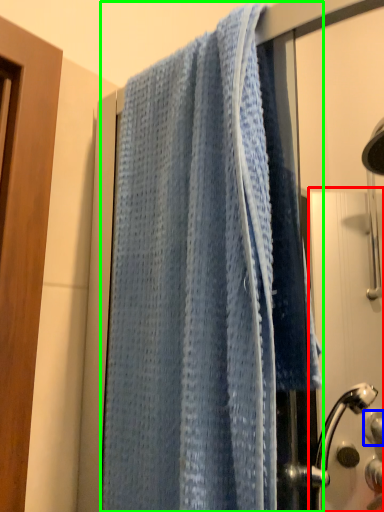
Question: Based on their relative distances, which object is nearer to screen door (highlighted by a red box)? Choose from knob (highlighted by a blue box) and towel (highlighted by a green box).

Choices:
 (A) knob
 (B) towel

Answer: (A)